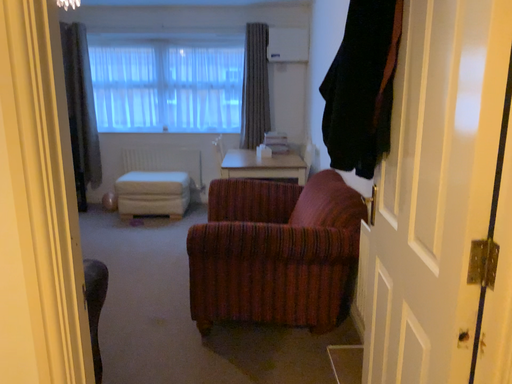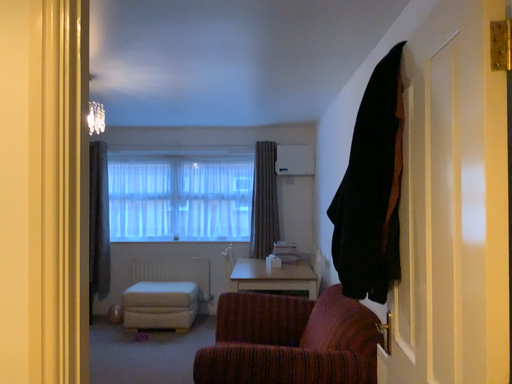
Question: How did the camera likely rotate when shooting the video?

Choices:
 (A) rotated downward
 (B) rotated upward

Answer: (B)